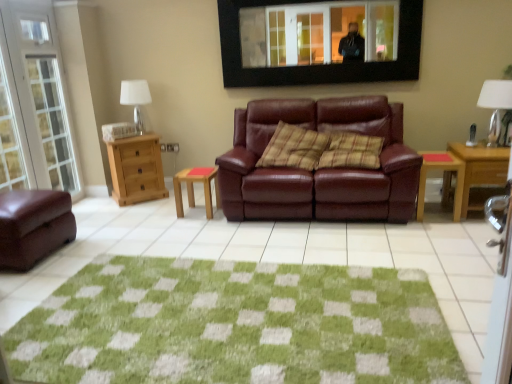
At what (x,y) coordinates should I click in order to perform the action: click on free space below wooden side table at right, which is counted as the 1th table, starting from the right (from a real-world perspective). Please return your answer as a coordinate pair (x, y). This screenshot has width=512, height=384. Looking at the image, I should click on [436, 213].